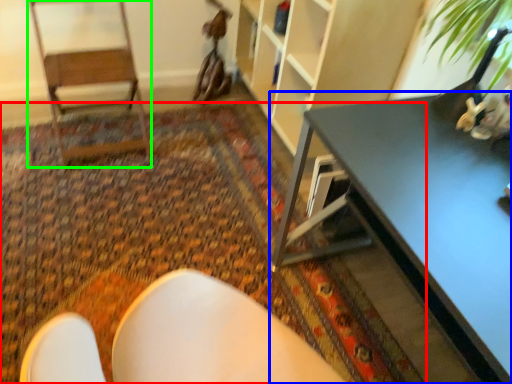
Question: Based on their relative distances, which object is farther from mat (highlighted by a red box)? Choose from table (highlighted by a blue box) and armchair (highlighted by a green box).

Choices:
 (A) table
 (B) armchair

Answer: (A)